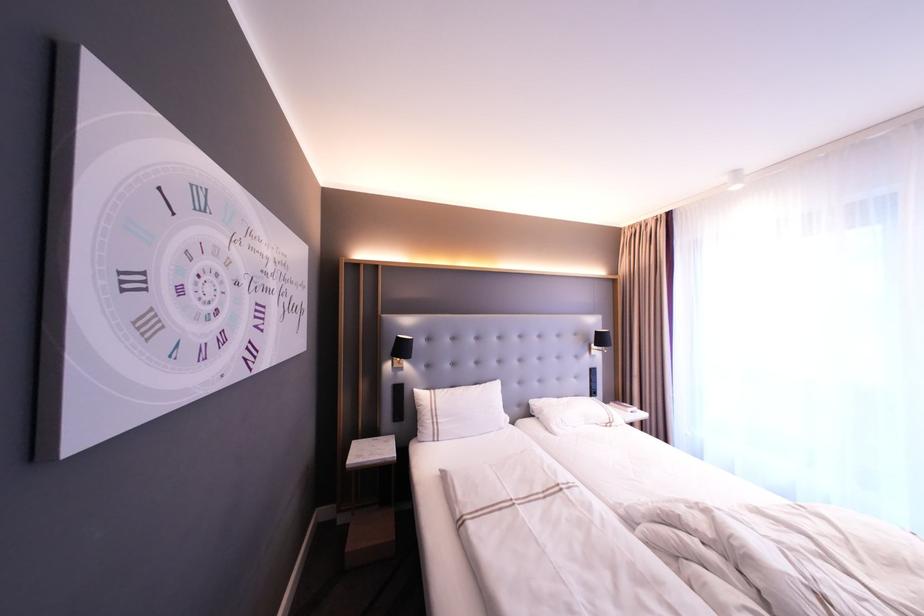
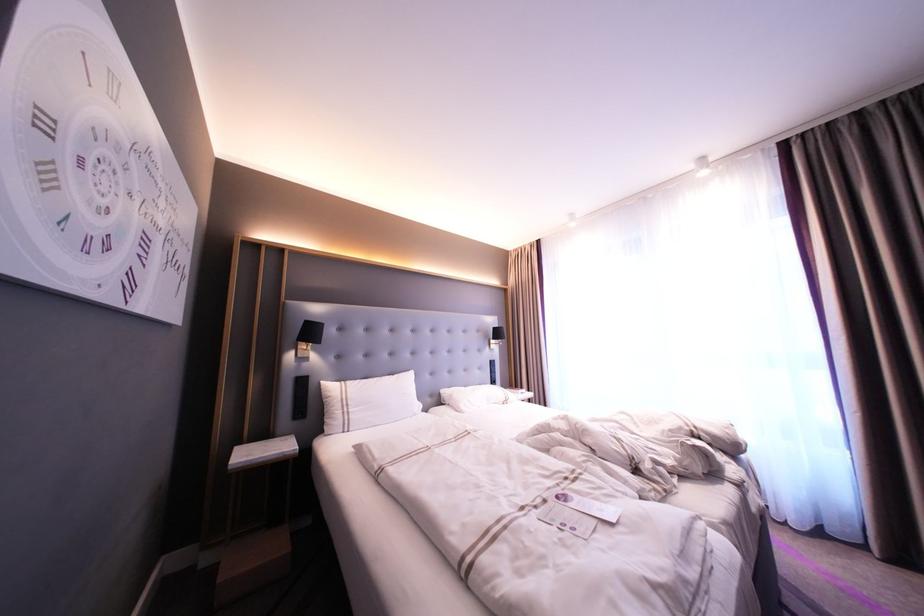
Question: The camera is either moving clockwise (left) or counter-clockwise (right) around the object. The first image is from the beginning of the video and the second image is from the end. Is the camera moving left or right when shooting the video?

Choices:
 (A) Left
 (B) Right

Answer: (A)